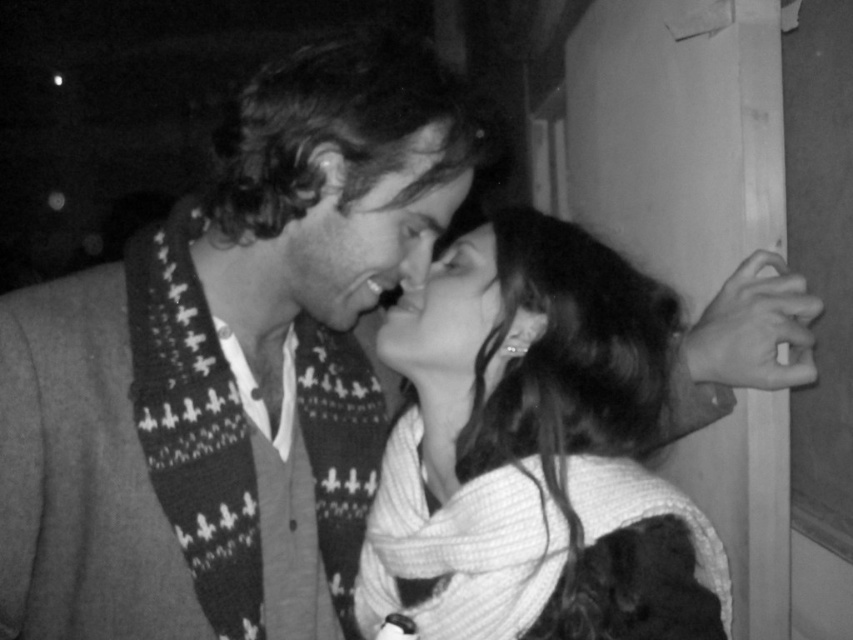
Does point (648, 586) come closer to viewer compared to point (306, 224)?

Yes, point (648, 586) is closer to viewer.

Which of these two, white textured scarf at center or knitted scarf at center, stands shorter?

knitted scarf at center

This screenshot has height=640, width=853. Identify the location of white textured scarf at center. (538, 436).

Is point (541, 225) in front of point (438, 340)?

No, it is behind (438, 340).

Which of these two, white textured scarf at center or smooth skin face at center, stands taller?

Standing taller between the two is white textured scarf at center.

The image size is (853, 640). Find the location of `white textured scarf at center`. white textured scarf at center is located at coordinates (538, 436).

Is knitted scarf at center shorter than smooth skin face at center?

No, knitted scarf at center is not shorter than smooth skin face at center.

Which of these two, knitted scarf at center or smooth skin face at center, stands taller?

knitted scarf at center is taller.

At what (x,y) coordinates should I click in order to perform the action: click on knitted scarf at center. Please return your answer as a coordinate pair (x, y). The width and height of the screenshot is (853, 640). Looking at the image, I should click on (367, 230).